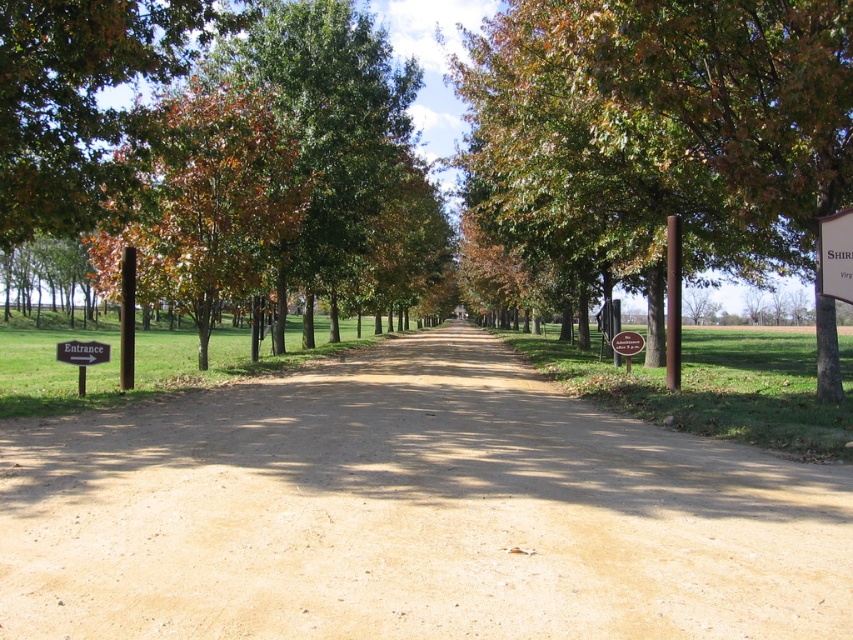
Does white plastic sign at upper right have a larger size compared to brown wooden sign at left?

Correct, white plastic sign at upper right is larger in size than brown wooden sign at left.

Is white plastic sign at upper right above brown wooden sign at left?

Yes, white plastic sign at upper right is above brown wooden sign at left.

Does point (844, 280) come farther from viewer compared to point (105, 344)?

No, it is in front of (105, 344).

Identify the location of white plastic sign at upper right. (834, 256).

Can you confirm if brown sandy dirt track at center is positioned above green leafy tree at upper left?

Incorrect, brown sandy dirt track at center is not positioned above green leafy tree at upper left.

Is brown sandy dirt track at center closer to camera compared to green leafy tree at upper left?

Yes, brown sandy dirt track at center is closer to the viewer.

Find the location of a particular element. The height and width of the screenshot is (640, 853). brown sandy dirt track at center is located at coordinates click(410, 513).

Does green leafy tree at center lie behind brown wooden sign at lower left?

No, green leafy tree at center is closer to the viewer.

Can you confirm if green leafy tree at center is shorter than brown wooden sign at lower left?

Incorrect, green leafy tree at center's height does not fall short of brown wooden sign at lower left's.

Describe the element at coordinates (660, 124) in the screenshot. I see `green leafy tree at center` at that location.

You are a GUI agent. You are given a task and a screenshot of the screen. Output one action in this format:
    pyautogui.click(x=<x>, y=<y>)
    Task: Click on the green leafy tree at center
    
    Given the screenshot: What is the action you would take?
    pyautogui.click(x=660, y=124)